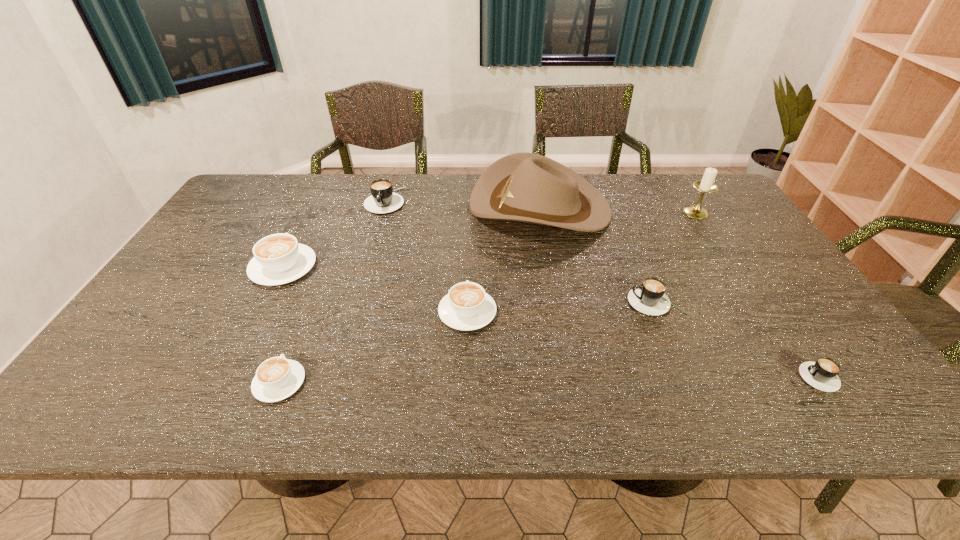
Identify the location of free spot between the second nearest black cappuccino and the cowboy hat. (598, 254).

The image size is (960, 540). Identify the location of empty space that is in between the cowboy hat and the second black cappuccino from left to right. (598, 254).

Choose which object is the sixth nearest neighbor to the second nearest white cappuccino. Please provide its 2D coordinates. Your answer should be formatted as a tuple, i.e. [(x, y)], where the tuple contains the x and y coordinates of a point satisfying the conditions above.

[(822, 374)]

Select which object is the third closest to the smallest white cappuccino. Please provide its 2D coordinates. Your answer should be formatted as a tuple, i.e. [(x, y)], where the tuple contains the x and y coordinates of a point satisfying the conditions above.

[(525, 187)]

Select which cappuccino is the sixth closest to the white candle holder. Please provide its 2D coordinates. Your answer should be formatted as a tuple, i.e. [(x, y)], where the tuple contains the x and y coordinates of a point satisfying the conditions above.

[(277, 378)]

At what (x,y) coordinates should I click in order to perform the action: click on the closest cappuccino to the rightmost cappuccino. Please return your answer as a coordinate pair (x, y). The height and width of the screenshot is (540, 960). Looking at the image, I should click on (649, 298).

Where is `white cappuccino that is the closest to the cowboy hat`? This screenshot has height=540, width=960. white cappuccino that is the closest to the cowboy hat is located at coordinates (466, 307).

Point out which white cappuccino is positioned as the nearest to the biggest white cappuccino. Please provide its 2D coordinates. Your answer should be formatted as a tuple, i.e. [(x, y)], where the tuple contains the x and y coordinates of a point satisfying the conditions above.

[(277, 378)]

Image resolution: width=960 pixels, height=540 pixels. Find the location of `the third closest black cappuccino to the cowboy hat`. the third closest black cappuccino to the cowboy hat is located at coordinates (822, 374).

Point out which black cappuccino is positioned as the third nearest to the second smallest white cappuccino. Please provide its 2D coordinates. Your answer should be formatted as a tuple, i.e. [(x, y)], where the tuple contains the x and y coordinates of a point satisfying the conditions above.

[(822, 374)]